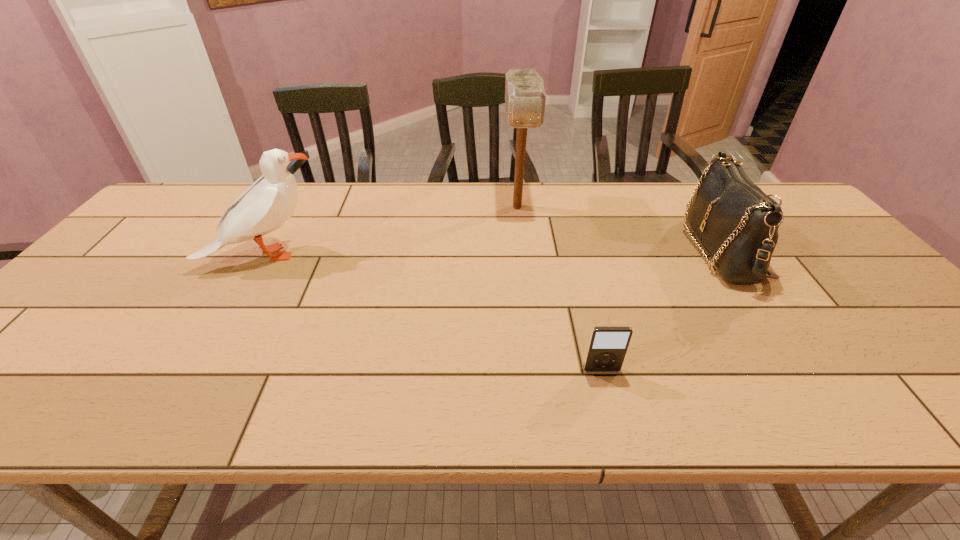
At what (x,y) coordinates should I click in order to perform the action: click on vacant space situated 0.190m at the front of the handbag with chain and zipper. Please return your answer as a coordinate pair (x, y). The image size is (960, 540). Looking at the image, I should click on (622, 250).

Where is `blank area located at the front of the handbag with chain and zipper`? blank area located at the front of the handbag with chain and zipper is located at coordinates (564, 250).

You are a GUI agent. You are given a task and a screenshot of the screen. Output one action in this format:
    pyautogui.click(x=<x>, y=<y>)
    Task: Click on the vacant space located at the front of the handbag with chain and zipper
    This screenshot has width=960, height=540.
    Given the screenshot: What is the action you would take?
    [647, 250]

The image size is (960, 540). What are the coordinates of `mallet situated at the far edge` in the screenshot? It's located at (525, 99).

Find the location of a particular element. handbag present at the far edge is located at coordinates (737, 223).

Find the location of `free region at the far edge`. free region at the far edge is located at coordinates (411, 203).

Where is `vacant point at the near edge`? The width and height of the screenshot is (960, 540). vacant point at the near edge is located at coordinates (325, 397).

Identify the location of free space at the far right corner of the desktop. (792, 205).

Find the location of `free spot between the third tallest object and the mallet`. free spot between the third tallest object and the mallet is located at coordinates (618, 228).

This screenshot has width=960, height=540. I want to click on blank region between the handbag and the iPod, so click(x=660, y=310).